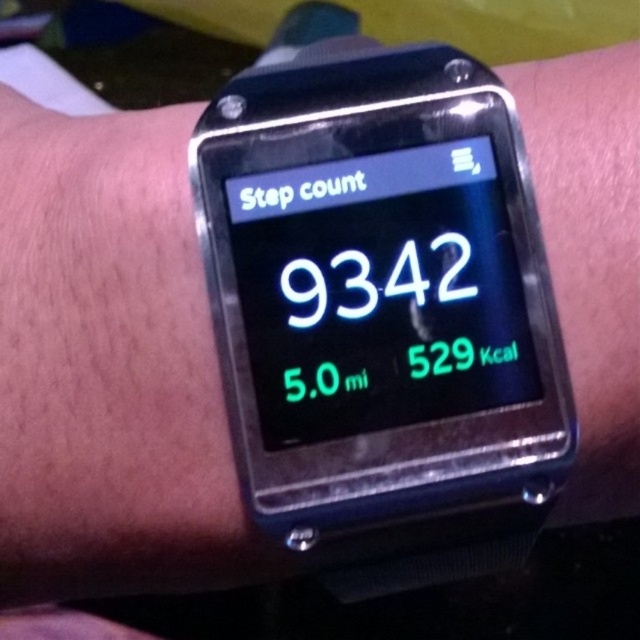
Question: Which point appears closest to the camera in this image?

Choices:
 (A) (232, 380)
 (B) (12, 170)

Answer: (A)

Question: Does black plastic watch at center appear on the left side of black matte watch at center?

Choices:
 (A) yes
 (B) no

Answer: (B)

Question: Is black plastic watch at center to the right of black matte watch at center from the viewer's perspective?

Choices:
 (A) no
 (B) yes

Answer: (B)

Question: Observing the image, what is the correct spatial positioning of black plastic watch at center in reference to black matte watch at center?

Choices:
 (A) below
 (B) above

Answer: (B)